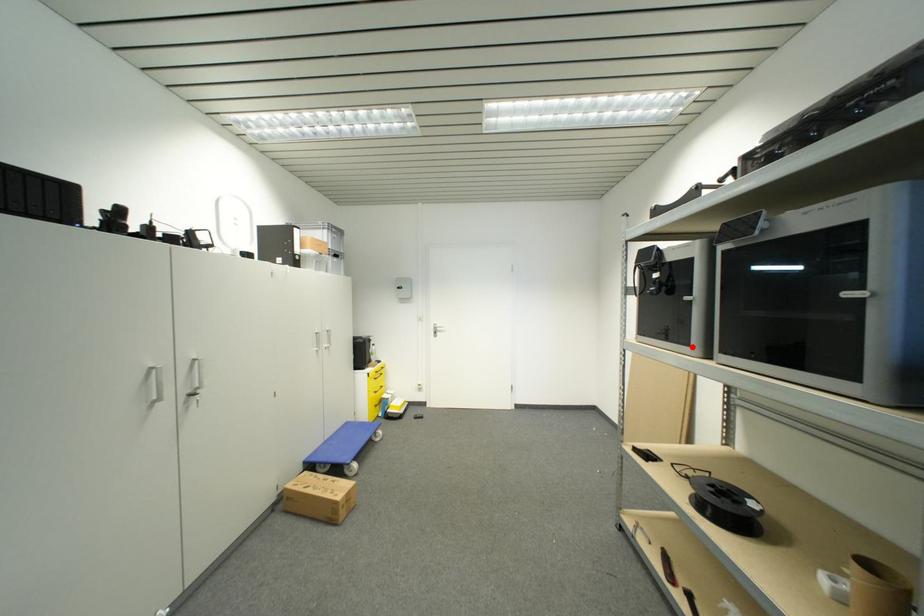
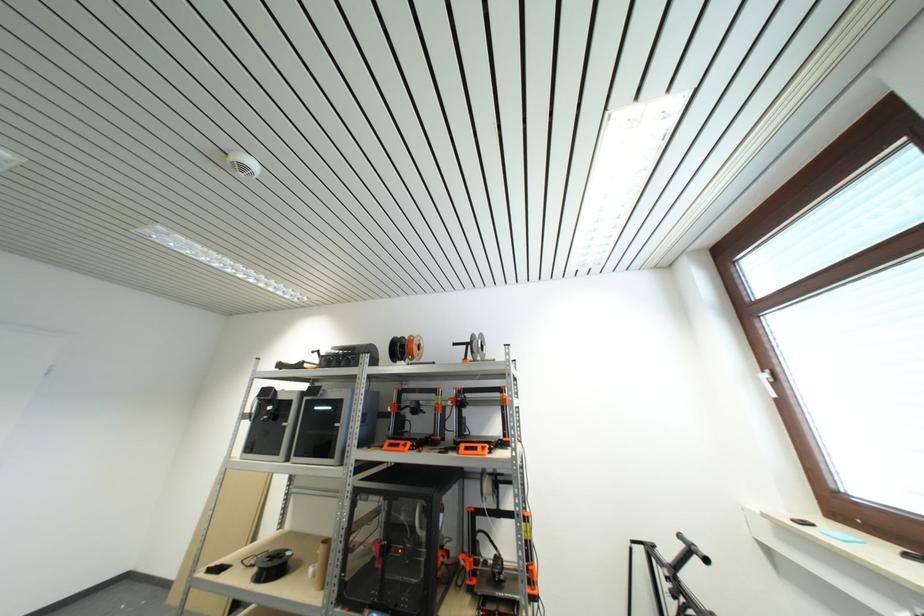
Question: A red point is marked in image1. In image2, is the corresponding 3D point closer to the camera or farther? Reply with the corresponding letter.

Choices:
 (A) The corresponding 3D point is closer.
 (B) The corresponding 3D point is farther.

Answer: (B)